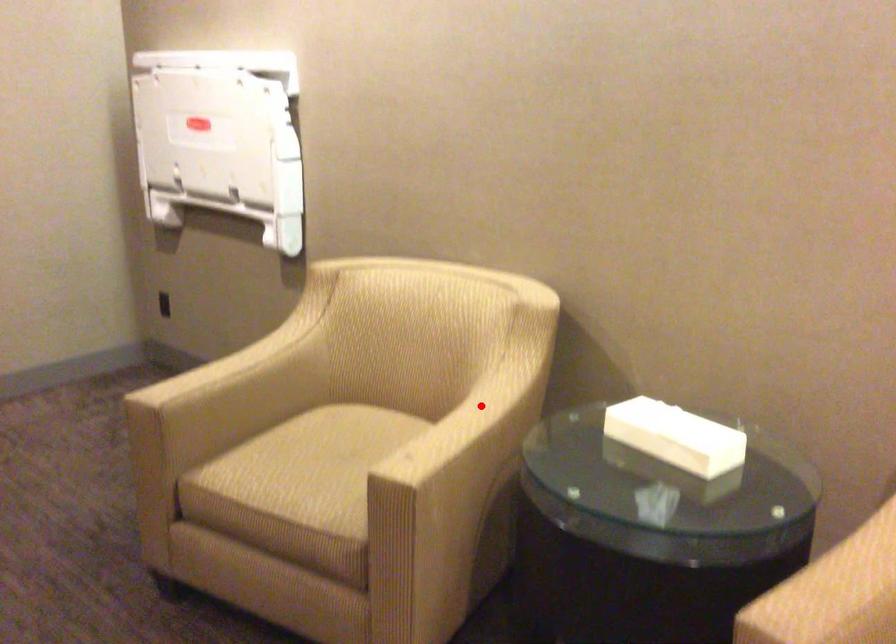
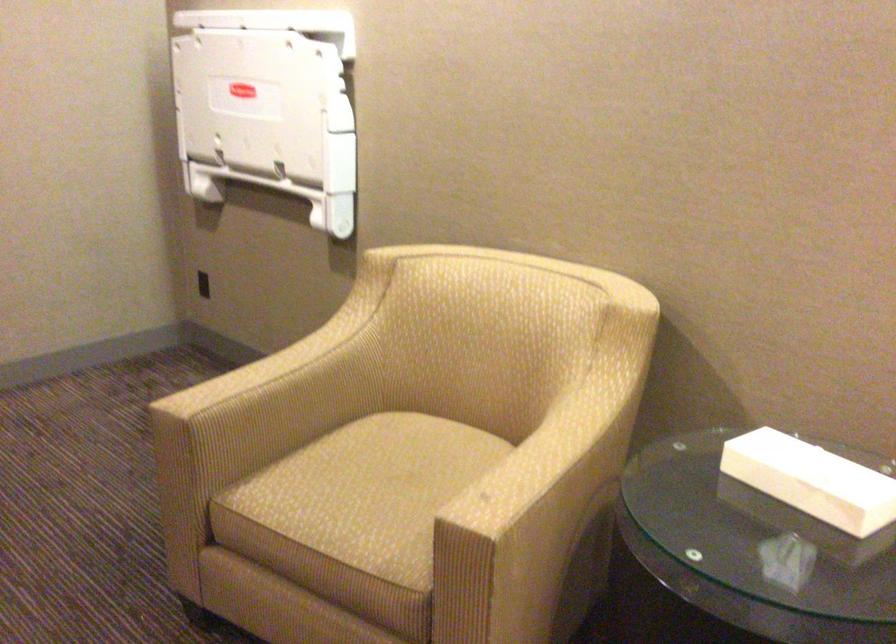
Question: I am providing you with two images of the same scene from different viewpoints. Image1 has a red point marked. In image2, the corresponding 3D location appears at what relative position? Reply with the corresponding letter.

Choices:
 (A) Closer
 (B) Farther

Answer: (A)